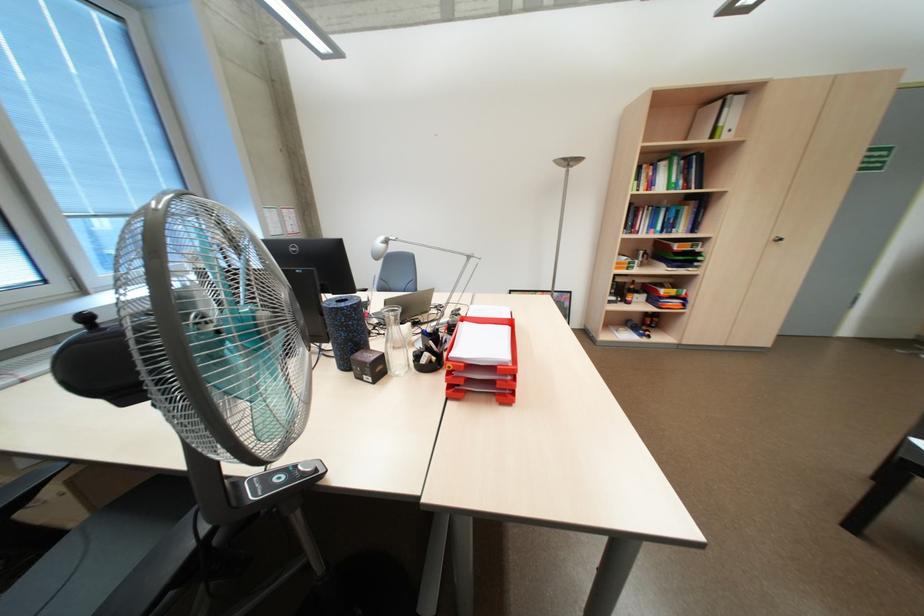
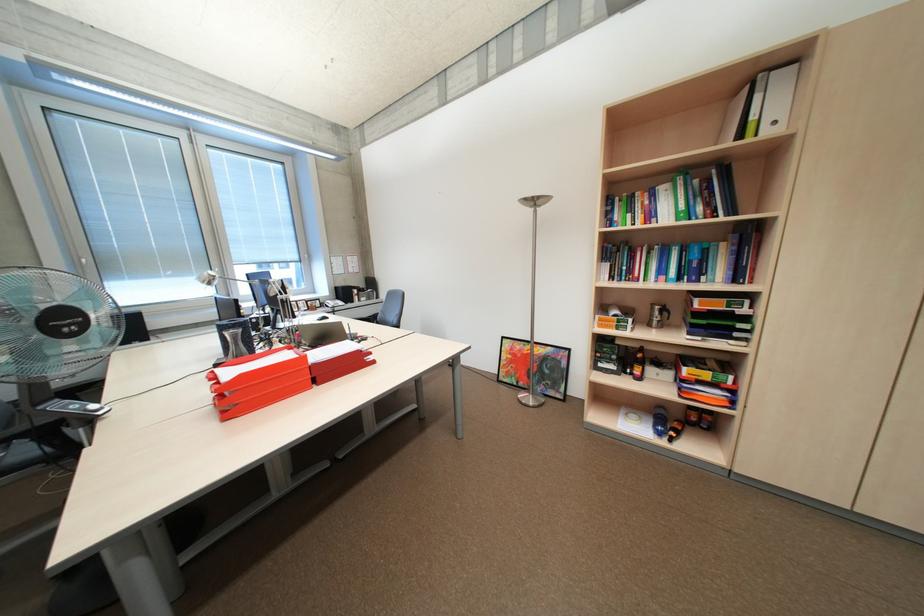
In the second image, find the point that corresponds to (648,249) in the first image.

(663, 304)